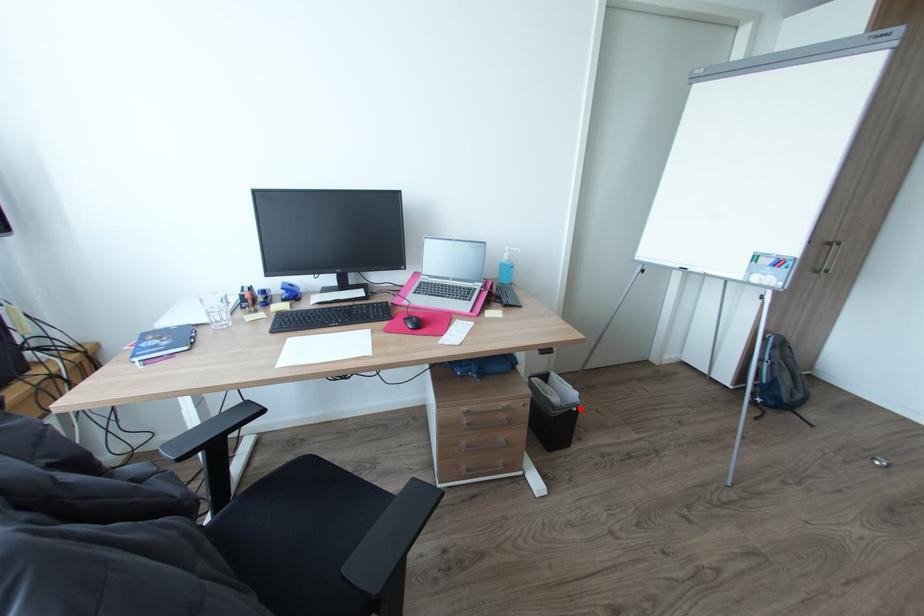
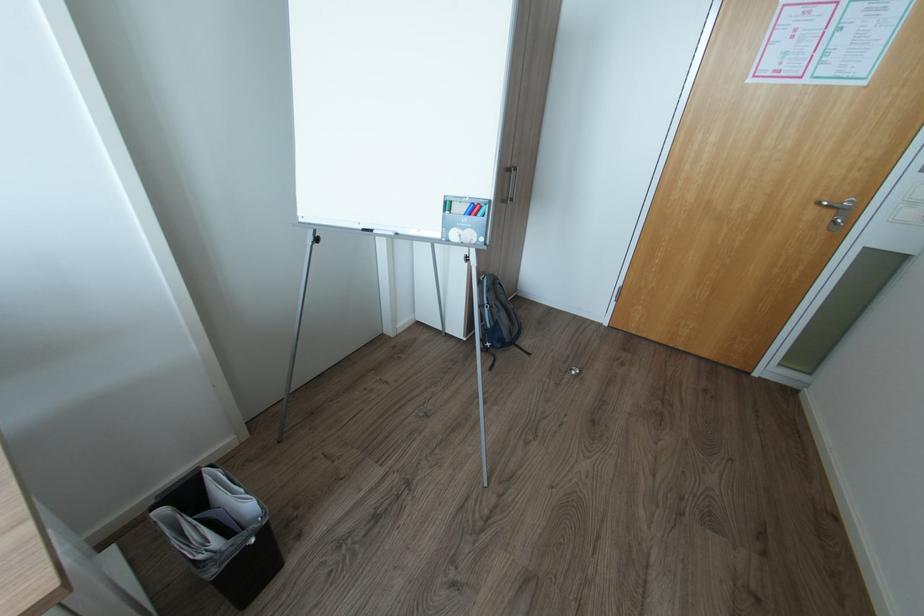
Find the pixel in the second image that matches the highlighted location in the first image.

(257, 541)